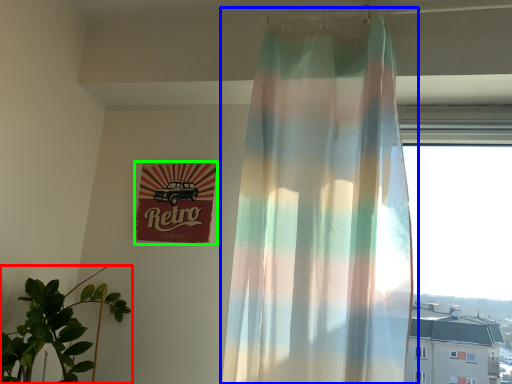
Question: Considering the real-world distances, which object is closest to houseplant (highlighted by a red box)? curtain (highlighted by a blue box) or signage (highlighted by a green box).

Choices:
 (A) curtain
 (B) signage

Answer: (B)